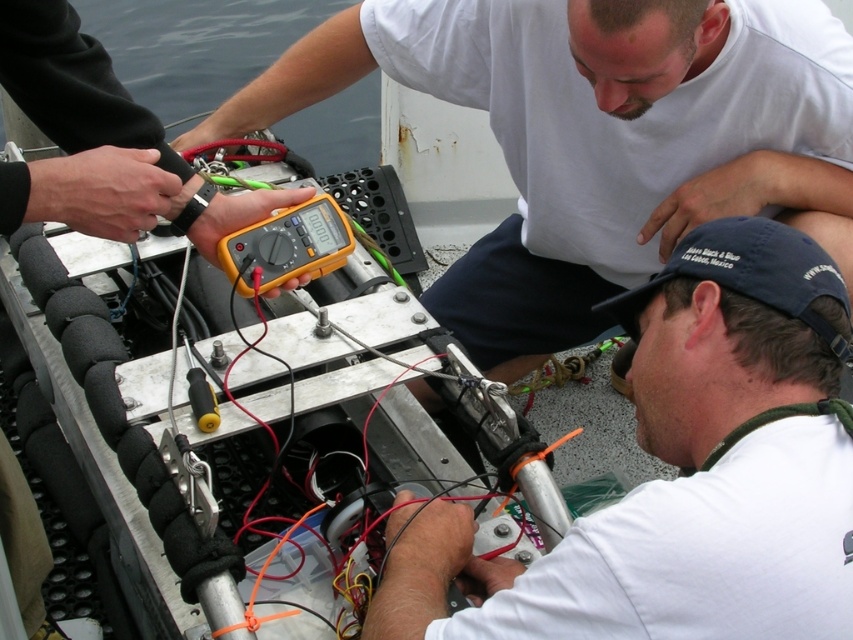
Does yellow plastic multimeter at center appear on the right side of white matte cap at lower right?

In fact, yellow plastic multimeter at center is to the left of white matte cap at lower right.

Can you confirm if yellow plastic multimeter at center is taller than white matte cap at lower right?

Indeed, yellow plastic multimeter at center has a greater height compared to white matte cap at lower right.

Locate an element on the screen. Image resolution: width=853 pixels, height=640 pixels. yellow plastic multimeter at center is located at coordinates (596, 138).

The width and height of the screenshot is (853, 640). In order to click on yellow plastic multimeter at center in this screenshot , I will do click(596, 138).